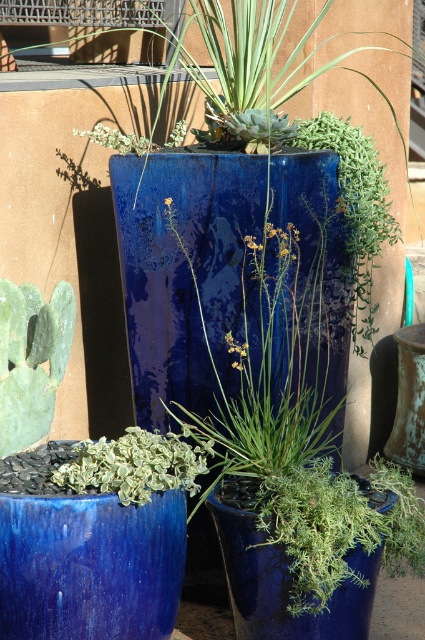
Question: Is green matte cactus at lower left to the right of green variegated leaf at center from the viewer's perspective?

Choices:
 (A) yes
 (B) no

Answer: (B)

Question: Does green matte cactus at lower left appear over green variegated leaf at center?

Choices:
 (A) yes
 (B) no

Answer: (A)

Question: Among these objects, which one is nearest to the camera?

Choices:
 (A) green variegated leaf at center
 (B) green matte cactus at lower left

Answer: (A)

Question: Is green matte cactus at lower left bigger than green variegated leaf at center?

Choices:
 (A) no
 (B) yes

Answer: (A)

Question: Which point is farther to the camera?

Choices:
 (A) green variegated leaf at center
 (B) green matte cactus at lower left

Answer: (B)